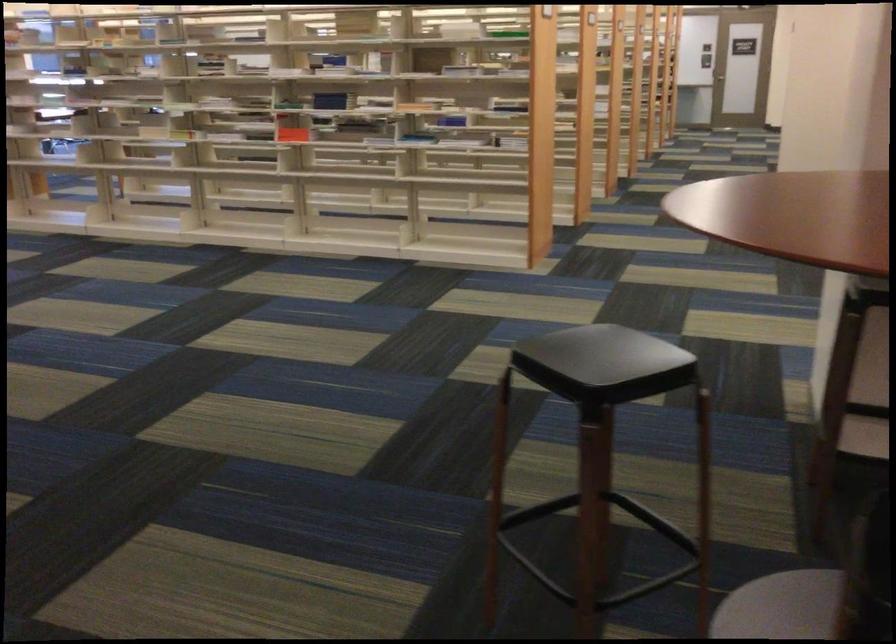
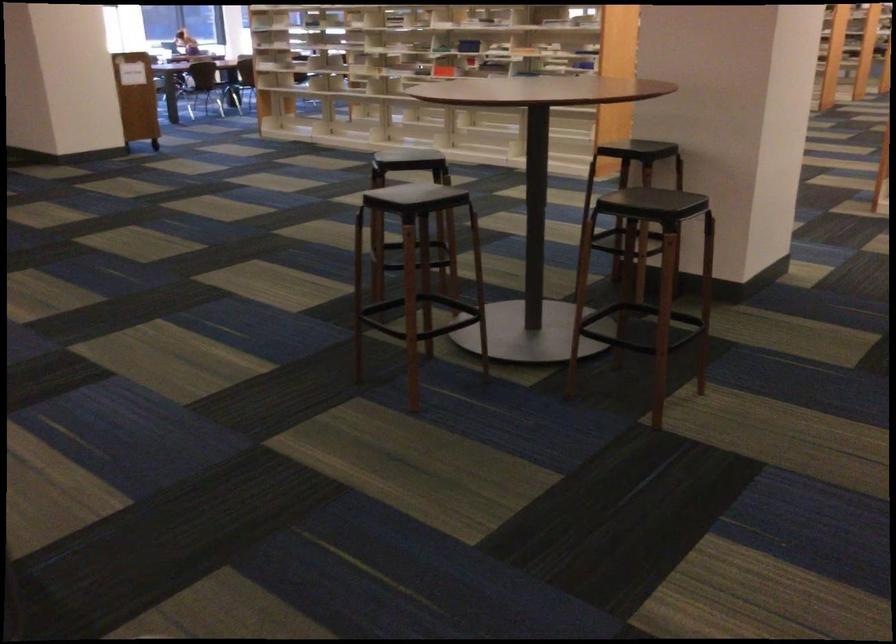
Locate, in the second image, the point that corresponds to (294,176) in the first image.

(418, 75)